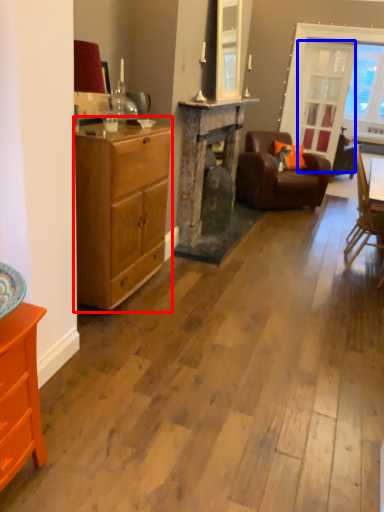
Question: Which object appears closest to the camera in this image, chest of drawers (highlighted by a red box) or glass door (highlighted by a blue box)?

Choices:
 (A) chest of drawers
 (B) glass door

Answer: (A)